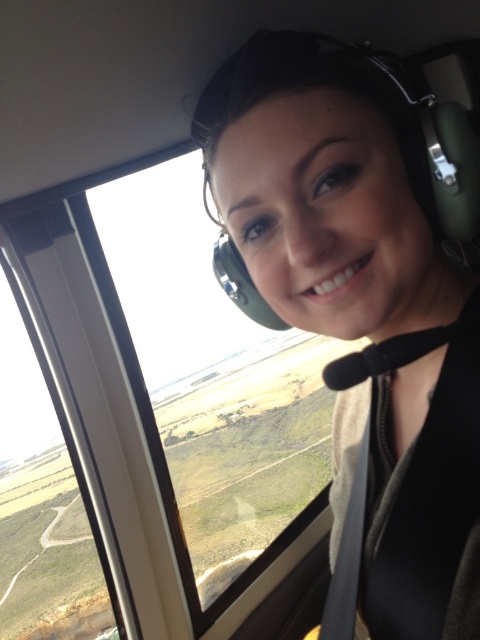
Who is taller, matte green headset at center or transparent glass airplane window at center?

transparent glass airplane window at center is taller.

Can you confirm if matte green headset at center is taller than transparent glass airplane window at center?

In fact, matte green headset at center may be shorter than transparent glass airplane window at center.

Is point (340, 515) positioned behind point (288, 353)?

No, it is in front of (288, 353).

In order to click on matte green headset at center in this screenshot , I will do `click(360, 307)`.